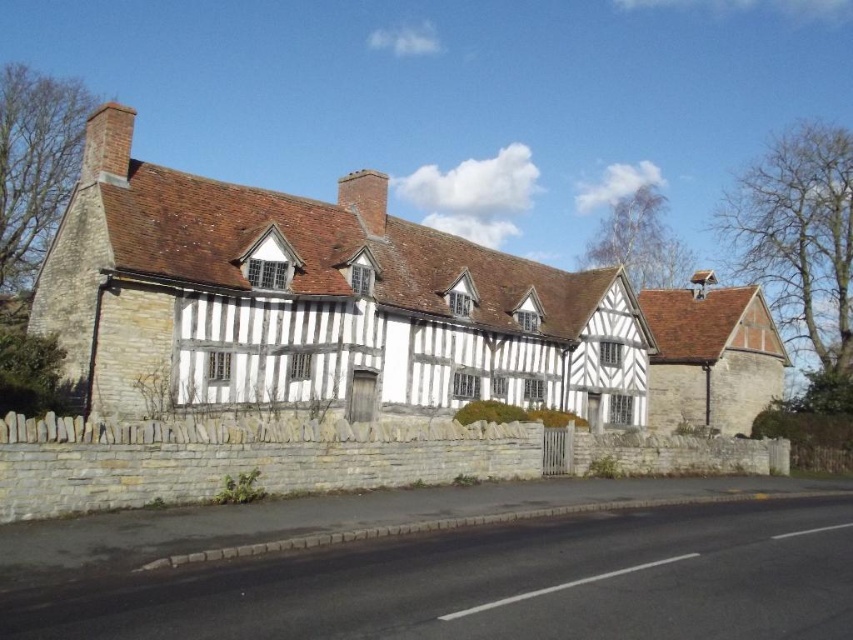
Based on the photo, does white timber-framed house at center come in front of brown shingles at upper right?

Yes, it is.

Does white timber-framed house at center have a smaller size compared to brown shingles at upper right?

No, white timber-framed house at center is not smaller than brown shingles at upper right.

Does point (225, 321) come farther from viewer compared to point (727, 416)?

No, (225, 321) is closer to viewer.

Where is `white timber-framed house at center`? white timber-framed house at center is located at coordinates (315, 301).